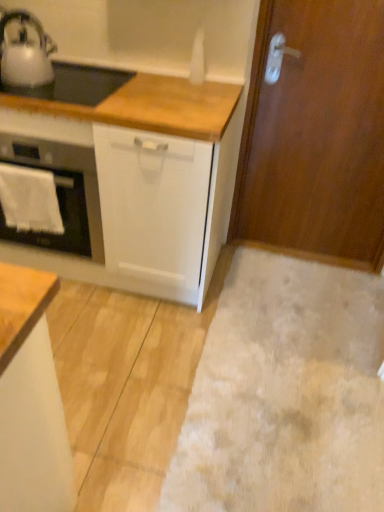
At what (x,y) coordinates should I click in order to perform the action: click on free space in front of metallic silver kettle at upper left. Please return your answer as a coordinate pair (x, y). The height and width of the screenshot is (512, 384). Looking at the image, I should click on (22, 93).